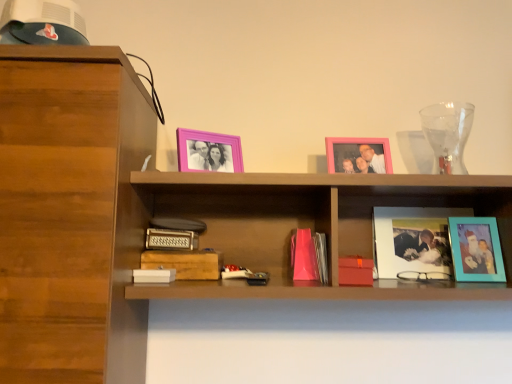
Where is `teal matte picture frame at right, the first picture frame from the right`? This screenshot has width=512, height=384. teal matte picture frame at right, the first picture frame from the right is located at coordinates (476, 249).

How much space does pink plastic picture frame at upper center, placed as the 1th picture frame when sorted from left to right, occupy vertically?

pink plastic picture frame at upper center, placed as the 1th picture frame when sorted from left to right, is 5.85 inches tall.

Locate an element on the screen. The height and width of the screenshot is (384, 512). pink matte picture frame at upper center, the second picture frame viewed from the left is located at coordinates (359, 154).

What do you see at coordinates (359, 154) in the screenshot? I see `pink matte picture frame at upper center, the third picture frame in the right-to-left sequence` at bounding box center [359, 154].

In order to click on teal matte picture frame at right, the first picture frame from the right in this screenshot , I will do `click(476, 249)`.

Are metallic silver paperback book at center, which is counted as the 3th paperback book, starting from the right, and matte red paperback book at center, the first paperback book when ordered from right to left, beside each other?

No, metallic silver paperback book at center, which is counted as the 3th paperback book, starting from the right, is not in contact with matte red paperback book at center, the first paperback book when ordered from right to left.

Is the position of metallic silver paperback book at center, placed as the 2th paperback book when sorted from left to right, less distant than that of matte red paperback book at center, arranged as the 4th paperback book when viewed from the left?

No, it is not.

Could you tell me if metallic silver paperback book at center, placed as the 2th paperback book when sorted from left to right, is turned towards matte red paperback book at center, arranged as the 4th paperback book when viewed from the left?

No, metallic silver paperback book at center, placed as the 2th paperback book when sorted from left to right, is not turned towards matte red paperback book at center, arranged as the 4th paperback book when viewed from the left.

You are a GUI agent. You are given a task and a screenshot of the screen. Output one action in this format:
    pyautogui.click(x=<x>, y=<y>)
    Task: Click on the 2nd paperback book in front when counting from the wooden paperback book at center, which is counted as the 2th paperback book, starting from the right
    The image size is (512, 384).
    Given the screenshot: What is the action you would take?
    pyautogui.click(x=355, y=271)

Which is closer, (211, 260) or (353, 277)?

Positioned in front is point (353, 277).

Is wooden paperback book at center, which is counted as the 2th paperback book, starting from the right, situated inside matte red paperback book at center, arranged as the 4th paperback book when viewed from the left, or outside?

wooden paperback book at center, which is counted as the 2th paperback book, starting from the right, cannot be found inside matte red paperback book at center, arranged as the 4th paperback book when viewed from the left.

Considering the positions of objects wooden paperback book at center, which is counted as the 2th paperback book, starting from the right, and matte red paperback book at center, the first paperback book when ordered from right to left, in the image provided, who is more to the right, wooden paperback book at center, which is counted as the 2th paperback book, starting from the right, or matte red paperback book at center, the first paperback book when ordered from right to left,?

matte red paperback book at center, the first paperback book when ordered from right to left, is more to the right.

Based on the photo, from a real-world perspective, is transparent glass vase at upper right physically located above or below teal matte picture frame at right, the first picture frame from the right?

Clearly, from a real-world perspective, transparent glass vase at upper right is above teal matte picture frame at right, the first picture frame from the right.

Image resolution: width=512 pixels, height=384 pixels. I want to click on glass vase on the left of teal matte picture frame at right, the fourth picture frame positioned from the left, so click(x=447, y=134).

Does point (424, 132) lie in front of point (494, 240)?

No.

Based on their positions, is metallic silver paperback book at center, which is counted as the 3th paperback book, starting from the right, located to the left or right of white matte paperback book at lower center, which appears as the fourth paperback book when viewed from the right?

From the image, it's evident that metallic silver paperback book at center, which is counted as the 3th paperback book, starting from the right, is to the right of white matte paperback book at lower center, which appears as the fourth paperback book when viewed from the right.

Looking at this image, considering the sizes of objects metallic silver paperback book at center, which is counted as the 3th paperback book, starting from the right, and white matte paperback book at lower center, which appears as the fourth paperback book when viewed from the right, in the image provided, who is thinner, metallic silver paperback book at center, which is counted as the 3th paperback book, starting from the right, or white matte paperback book at lower center, which appears as the fourth paperback book when viewed from the right,?

white matte paperback book at lower center, which appears as the fourth paperback book when viewed from the right.

Which is less distant, (153, 247) or (141, 276)?

Point (153, 247) appears to be farther away from the viewer than point (141, 276).

Is metallic silver paperback book at center, placed as the 2th paperback book when sorted from left to right, next to white matte paperback book at lower center, which ranks as the first paperback book in left-to-right order?

No, metallic silver paperback book at center, placed as the 2th paperback book when sorted from left to right, is not with white matte paperback book at lower center, which ranks as the first paperback book in left-to-right order.

Would you say wooden shelf at center is outside pink matte picture frame at upper center, the second picture frame viewed from the left?

wooden shelf at center lies outside pink matte picture frame at upper center, the second picture frame viewed from the left,'s area.

From the image's perspective, would you say wooden shelf at center is shown under pink matte picture frame at upper center, the third picture frame in the right-to-left sequence?

Yes, from the image's perspective, wooden shelf at center is below pink matte picture frame at upper center, the third picture frame in the right-to-left sequence.

Can you tell me how much wooden shelf at center and pink matte picture frame at upper center, the second picture frame viewed from the left, differ in facing direction?

There is a 2.64-degree angle between the facing directions of wooden shelf at center and pink matte picture frame at upper center, the second picture frame viewed from the left.

Identify the location of cabinetry that is on the left side of metallic silver paperback book at center, which is counted as the 3th paperback book, starting from the right. (71, 214).

Consider the image. Between metallic silver paperback book at center, which is counted as the 3th paperback book, starting from the right, and wooden cabinet at left, which one has smaller width?

Thinner between the two is metallic silver paperback book at center, which is counted as the 3th paperback book, starting from the right.

Is metallic silver paperback book at center, placed as the 2th paperback book when sorted from left to right, spatially inside wooden cabinet at left, or outside of it?

The correct answer is: outside.

How different are the orientations of metallic silver paperback book at center, which is counted as the 3th paperback book, starting from the right, and wooden cabinet at left in degrees?

The angular difference between metallic silver paperback book at center, which is counted as the 3th paperback book, starting from the right, and wooden cabinet at left is 1.03 degrees.

Is wooden paperback book at center, marked as the 3th paperback book in a left-to-right arrangement, aimed at matte glass photo frame at center right, positioned as the 3th picture frame in left-to-right order?

No, wooden paperback book at center, marked as the 3th paperback book in a left-to-right arrangement, is not facing towards matte glass photo frame at center right, positioned as the 3th picture frame in left-to-right order.

From a real-world perspective, between wooden paperback book at center, which is counted as the 2th paperback book, starting from the right, and matte glass photo frame at center right, which is counted as the second picture frame, starting from the right, who is vertically higher?

matte glass photo frame at center right, which is counted as the second picture frame, starting from the right, from a real-world perspective.

Considering the positions of objects wooden paperback book at center, marked as the 3th paperback book in a left-to-right arrangement, and matte glass photo frame at center right, which is counted as the second picture frame, starting from the right, in the image provided, who is more to the left, wooden paperback book at center, marked as the 3th paperback book in a left-to-right arrangement, or matte glass photo frame at center right, which is counted as the second picture frame, starting from the right,?

wooden paperback book at center, marked as the 3th paperback book in a left-to-right arrangement.

What's the angular difference between wooden paperback book at center, marked as the 3th paperback book in a left-to-right arrangement, and matte glass photo frame at center right, positioned as the 3th picture frame in left-to-right order,'s facing directions?

7.82 degrees.

Find the location of a particular element. paperback book that is the 2nd one below the metallic silver paperback book at center, which is counted as the 3th paperback book, starting from the right (from a real-world perspective) is located at coordinates (x=355, y=271).

Starting from the matte red paperback book at center, the first paperback book when ordered from right to left, which paperback book is the 2nd one behind? Please provide its 2D coordinates.

[(185, 263)]

Considering their positions, is pink plastic picture frame at upper center, placed as the 1th picture frame when sorted from left to right, positioned closer to wooden paperback book at center, marked as the 3th paperback book in a left-to-right arrangement, than white matte paperback book at lower center, which ranks as the first paperback book in left-to-right order?

white matte paperback book at lower center, which ranks as the first paperback book in left-to-right order.

Estimate the real-world distances between objects in this image. Which object is further from matte red paperback book at center, arranged as the 4th paperback book when viewed from the left, wooden shelf at center or white matte paperback book at lower center, which appears as the fourth paperback book when viewed from the right?

white matte paperback book at lower center, which appears as the fourth paperback book when viewed from the right.

Based on the photo, when comparing their distances from metallic silver paperback book at center, which is counted as the 3th paperback book, starting from the right, does white matte paperback book at lower center, which appears as the fourth paperback book when viewed from the right, or transparent glass vase at upper right seem closer?

white matte paperback book at lower center, which appears as the fourth paperback book when viewed from the right.

Based on the photo, which object lies nearer to the anchor point wooden shelf at center, matte red paperback book at center, arranged as the 4th paperback book when viewed from the left, or pink plastic picture frame at upper center, which is counted as the 4th picture frame, starting from the right?

matte red paperback book at center, arranged as the 4th paperback book when viewed from the left.

Estimate the real-world distances between objects in this image. Which object is closer to metallic silver paperback book at center, which is counted as the 3th paperback book, starting from the right, wooden paperback book at center, marked as the 3th paperback book in a left-to-right arrangement, or transparent glass vase at upper right?

wooden paperback book at center, marked as the 3th paperback book in a left-to-right arrangement.

Based on their spatial positions, is transparent glass vase at upper right or white matte paperback book at lower center, which ranks as the first paperback book in left-to-right order, further from wooden shelf at center?

white matte paperback book at lower center, which ranks as the first paperback book in left-to-right order, is positioned further to the anchor wooden shelf at center.

Estimate the real-world distances between objects in this image. Which object is further from pink plastic picture frame at upper center, placed as the 1th picture frame when sorted from left to right, pink matte picture frame at upper center, the third picture frame in the right-to-left sequence, or white matte paperback book at lower center, which appears as the fourth paperback book when viewed from the right?

Based on the image, white matte paperback book at lower center, which appears as the fourth paperback book when viewed from the right, appears to be further to pink plastic picture frame at upper center, placed as the 1th picture frame when sorted from left to right.

Based on their spatial positions, is metallic silver paperback book at center, which is counted as the 3th paperback book, starting from the right, or wooden shelf at center closer to matte red paperback book at center, arranged as the 4th paperback book when viewed from the left?

Based on the image, wooden shelf at center appears to be nearer to matte red paperback book at center, arranged as the 4th paperback book when viewed from the left.

I want to click on paperback book situated between wooden paperback book at center, which is counted as the 2th paperback book, starting from the right, and teal matte picture frame at right, the first picture frame from the right, from left to right, so click(x=355, y=271).

The height and width of the screenshot is (384, 512). I want to click on glass vase between white matte paperback book at lower center, which ranks as the first paperback book in left-to-right order, and teal matte picture frame at right, the fourth picture frame positioned from the left, so click(x=447, y=134).

I want to click on shelf situated between pink plastic picture frame at upper center, placed as the 1th picture frame when sorted from left to right, and matte red paperback book at center, the first paperback book when ordered from right to left, from left to right, so click(x=308, y=226).

At what (x,y) coordinates should I click in order to perform the action: click on shelf between wooden paperback book at center, which is counted as the 2th paperback book, starting from the right, and transparent glass vase at upper right. Please return your answer as a coordinate pair (x, y). The image size is (512, 384). Looking at the image, I should click on (308, 226).